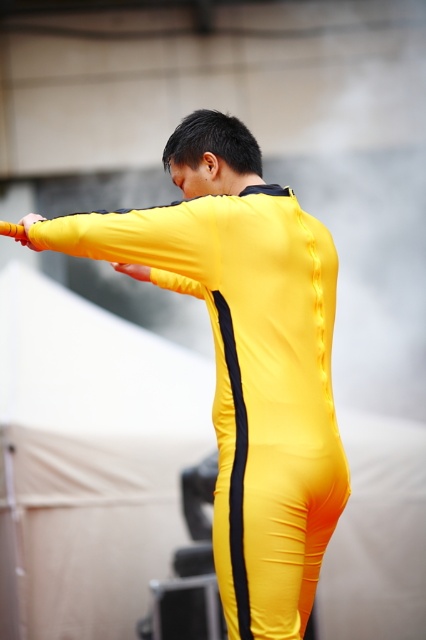
Question: Which object is farther from the camera taking this photo?

Choices:
 (A) matte yellow glove at upper center
 (B) yellow matte/satin jumpsuit at center

Answer: (A)

Question: Which object is positioned farthest from the matte yellow glove at upper center?

Choices:
 (A) yellow matte/satin jumpsuit at center
 (B) yellow matte arm at center

Answer: (A)

Question: Is yellow matte/satin jumpsuit at center positioned in front of yellow matte arm at center?

Choices:
 (A) no
 (B) yes

Answer: (B)

Question: Which of the following is the farthest from the observer?

Choices:
 (A) yellow matte/satin jumpsuit at center
 (B) yellow matte baton at upper left
 (C) matte yellow glove at upper center
 (D) yellow matte arm at center

Answer: (C)

Question: In this image, where is yellow matte/satin jumpsuit at center located relative to yellow matte arm at center?

Choices:
 (A) above
 (B) below

Answer: (B)

Question: Is yellow matte/satin jumpsuit at center smaller than yellow matte arm at center?

Choices:
 (A) no
 (B) yes

Answer: (A)